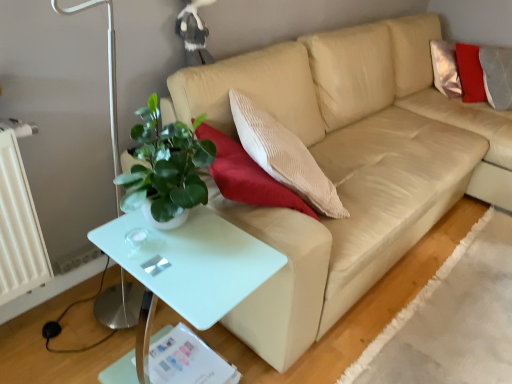
Question: Is white glossy table at lower left inside the boundaries of beige leather couch at center, or outside?

Choices:
 (A) outside
 (B) inside

Answer: (A)

Question: Considering the positions of point (129, 258) and point (267, 210), is point (129, 258) closer or farther from the camera than point (267, 210)?

Choices:
 (A) farther
 (B) closer

Answer: (B)

Question: From the image's perspective, relative to beige leather couch at center, is white glossy table at lower left above or below?

Choices:
 (A) above
 (B) below

Answer: (B)

Question: From the image's perspective, is beige leather couch at center positioned above or below white glossy table at lower left?

Choices:
 (A) below
 (B) above

Answer: (B)

Question: Based on their sizes in the image, would you say beige leather couch at center is bigger or smaller than white glossy table at lower left?

Choices:
 (A) small
 (B) big

Answer: (B)

Question: From a real-world perspective, is beige leather couch at center positioned above or below white glossy table at lower left?

Choices:
 (A) below
 (B) above

Answer: (B)

Question: Is beige leather couch at center inside the boundaries of white glossy table at lower left, or outside?

Choices:
 (A) outside
 (B) inside

Answer: (A)